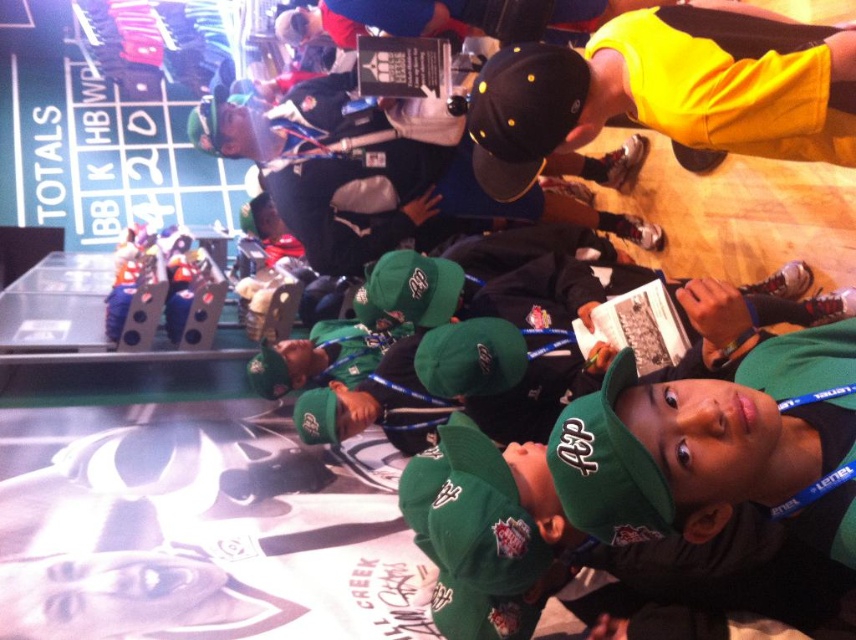
Does yellow matte cap at upper right appear under black matte baseball cap at upper center?

Incorrect, yellow matte cap at upper right is not positioned below black matte baseball cap at upper center.

Is point (560, 132) closer to camera compared to point (539, 76)?

No, (560, 132) is behind (539, 76).

The width and height of the screenshot is (856, 640). In order to click on yellow matte cap at upper right in this screenshot , I will do `click(669, 92)`.

What do you see at coordinates (669, 92) in the screenshot? This screenshot has height=640, width=856. I see `yellow matte cap at upper right` at bounding box center [669, 92].

Is point (601, 33) positioned in front of point (459, 364)?

Yes, point (601, 33) is closer to viewer.

This screenshot has height=640, width=856. Describe the element at coordinates (669, 92) in the screenshot. I see `yellow matte cap at upper right` at that location.

The width and height of the screenshot is (856, 640). What are the coordinates of `yellow matte cap at upper right` in the screenshot? It's located at (669, 92).

Is green fabric cap at center below black matte baseball cap at upper center?

Yes.

Is point (580, 436) in front of point (572, 128)?

Yes, point (580, 436) is in front of point (572, 128).

The height and width of the screenshot is (640, 856). What do you see at coordinates (718, 445) in the screenshot?
I see `green fabric cap at center` at bounding box center [718, 445].

Where is `green fabric cap at center`? green fabric cap at center is located at coordinates (718, 445).